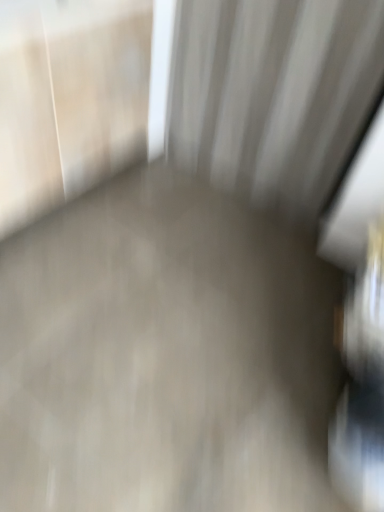
Where is `white textured curtain at upper center`? This screenshot has width=384, height=512. white textured curtain at upper center is located at coordinates (273, 94).

Looking at this image, measure the distance between point (x=300, y=144) and camera.

A distance of 1.53 meters exists between point (x=300, y=144) and camera.

The height and width of the screenshot is (512, 384). What do you see at coordinates (273, 94) in the screenshot? I see `white textured curtain at upper center` at bounding box center [273, 94].

The width and height of the screenshot is (384, 512). Describe the element at coordinates (165, 356) in the screenshot. I see `smooth concrete floor at center` at that location.

What are the coordinates of `smooth concrete floor at center` in the screenshot? It's located at (165, 356).

Locate an element on the screen. The height and width of the screenshot is (512, 384). white textured curtain at upper center is located at coordinates (273, 94).

Between smooth concrete floor at center and white textured curtain at upper center, which one appears on the left side from the viewer's perspective?

smooth concrete floor at center.

Looking at this image, which object is closer to the camera taking this photo, smooth concrete floor at center or white textured curtain at upper center?

smooth concrete floor at center.

Considering the positions of point (132, 305) and point (322, 137), is point (132, 305) closer or farther from the camera than point (322, 137)?

Clearly, point (132, 305) is closer to the camera than point (322, 137).

From the image's perspective, which is below, smooth concrete floor at center or white textured curtain at upper center?

smooth concrete floor at center is shown below in the image.

From a real-world perspective, which object rests below the other?

In real-world perspective, smooth concrete floor at center is lower.

Considering the sizes of objects smooth concrete floor at center and white textured curtain at upper center in the image provided, who is thinner, smooth concrete floor at center or white textured curtain at upper center?

white textured curtain at upper center.

Can you confirm if smooth concrete floor at center is shorter than white textured curtain at upper center?

Indeed, smooth concrete floor at center has a lesser height compared to white textured curtain at upper center.

Is smooth concrete floor at center bigger or smaller than white textured curtain at upper center?

In the image, smooth concrete floor at center appears to be larger than white textured curtain at upper center.

Is smooth concrete floor at center located outside white textured curtain at upper center?

Yes.

Are smooth concrete floor at center and white textured curtain at upper center located far from each other?

smooth concrete floor at center is near white textured curtain at upper center, not far away.

Is smooth concrete floor at center turned away from white textured curtain at upper center?

No, smooth concrete floor at center is not facing the opposite direction of white textured curtain at upper center.

Locate an element on the screen. This screenshot has width=384, height=512. curtain on the right of the smooth concrete floor at center is located at coordinates (273, 94).

Is white textured curtain at upper center to the right of smooth concrete floor at center from the viewer's perspective?

Indeed, white textured curtain at upper center is positioned on the right side of smooth concrete floor at center.

Is white textured curtain at upper center positioned behind smooth concrete floor at center?

Yes.

Considering the points (198, 148) and (146, 496), which point is in front, point (198, 148) or point (146, 496)?

Point (146, 496)

From the image's perspective, which one is positioned lower, white textured curtain at upper center or smooth concrete floor at center?

smooth concrete floor at center appears lower in the image.

From a real-world perspective, between white textured curtain at upper center and smooth concrete floor at center, who is vertically higher?

white textured curtain at upper center.

Between white textured curtain at upper center and smooth concrete floor at center, which one has larger width?

With larger width is smooth concrete floor at center.

Can you confirm if white textured curtain at upper center is shorter than smooth concrete floor at center?

No, white textured curtain at upper center is not shorter than smooth concrete floor at center.

Considering the sizes of white textured curtain at upper center and smooth concrete floor at center in the image, is white textured curtain at upper center bigger or smaller than smooth concrete floor at center?

In the image, white textured curtain at upper center appears to be smaller than smooth concrete floor at center.

Would you say white textured curtain at upper center is inside or outside smooth concrete floor at center?

white textured curtain at upper center is not enclosed by smooth concrete floor at center.

Are white textured curtain at upper center and smooth concrete floor at center beside each other?

No.

Is white textured curtain at upper center oriented away from smooth concrete floor at center?

No, white textured curtain at upper center is not facing the opposite direction of smooth concrete floor at center.

Locate an element on the screen. This screenshot has width=384, height=512. curtain that appears behind the smooth concrete floor at center is located at coordinates (273, 94).

Locate an element on the screen. The image size is (384, 512). concrete that appears on the left of white textured curtain at upper center is located at coordinates (165, 356).

This screenshot has width=384, height=512. Find the location of `curtain above the smooth concrete floor at center (from a real-world perspective)`. curtain above the smooth concrete floor at center (from a real-world perspective) is located at coordinates (273, 94).